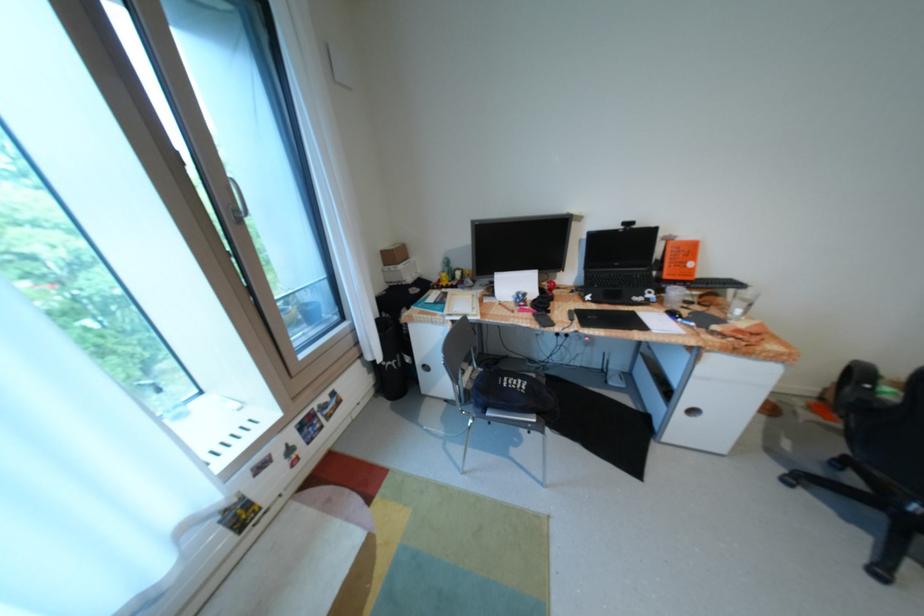
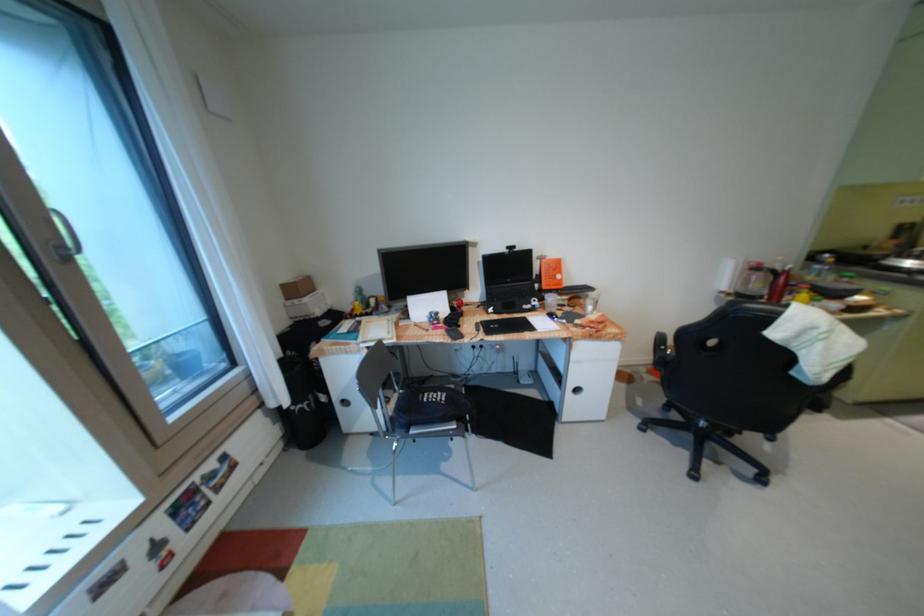
Locate, in the second image, the point that corresponds to pixel 695 403 in the first image.

(580, 386)